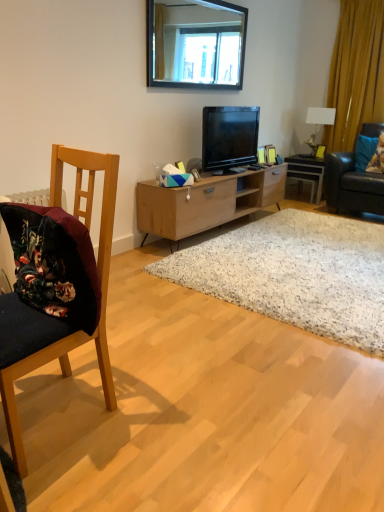
At what (x,y) coordinates should I click in order to perform the action: click on vacant space in velvet dark blue chair at left (from a real-world perspective). Please return your answer as a coordinate pair (x, y). The height and width of the screenshot is (512, 384). Looking at the image, I should click on pos(60,410).